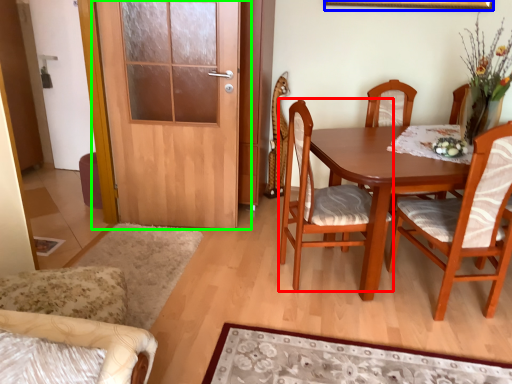
Question: Which is nearer to the chair (highlighted by a red box)? picture frame (highlighted by a blue box) or door (highlighted by a green box).

Choices:
 (A) picture frame
 (B) door

Answer: (B)